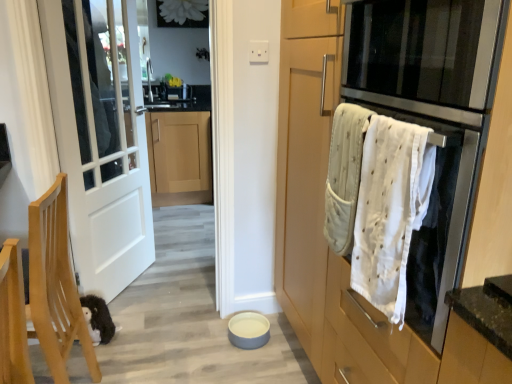
Where is `matte wood cabinet at right, positioned as the first cabinetry in front-to-back order`? This screenshot has width=512, height=384. matte wood cabinet at right, positioned as the first cabinetry in front-to-back order is located at coordinates (400, 125).

Measure the distance between white matte door at left and camera.

A distance of 1.73 meters exists between white matte door at left and camera.

At what (x,y) coordinates should I click in order to perform the action: click on wooden chair at lower left. Please return your answer as a coordinate pair (x, y). The image size is (512, 384). Looking at the image, I should click on (55, 285).

Is matte wood cabinet at right, which is the 1th cabinetry from right to left, positioned with its back to white textured towel at right?

Yes, matte wood cabinet at right, which is the 1th cabinetry from right to left,'s orientation is away from white textured towel at right.

Locate an element on the screen. bath towel that appears above the matte wood cabinet at right, which is the 1th cabinetry from right to left (from a real-world perspective) is located at coordinates (344, 175).

Which of these two, matte wood cabinet at right, which is the 1th cabinetry from right to left, or white textured towel at right, is smaller?

white textured towel at right is smaller.

Does point (480, 49) lie behind point (357, 157)?

No, it is not.

Is stainless steel oven at right, which is the first oven from top to bottom, with light wood cabinet at center, which is the first cabinetry in back-to-front order?

stainless steel oven at right, which is the first oven from top to bottom, is not next to light wood cabinet at center, which is the first cabinetry in back-to-front order, and they're not touching.

Does point (384, 22) come closer to viewer compared to point (170, 152)?

Yes, point (384, 22) is closer to viewer.

The height and width of the screenshot is (384, 512). In order to click on cabinetry above the stainless steel oven at right, which is the 2th oven in bottom-to-top order (from the image's perspective) in this screenshot , I will do `click(179, 157)`.

Between stainless steel oven at right, which is the 2th oven in bottom-to-top order, and light wood cabinet at center, arranged as the second cabinetry when viewed from the right, which one appears on the left side from the viewer's perspective?

light wood cabinet at center, arranged as the second cabinetry when viewed from the right.

From a real-world perspective, is white glossy sink at upper center physically located above or below white textured towel at right?

From a real-world perspective, white glossy sink at upper center is physically above white textured towel at right.

You are a GUI agent. You are given a task and a screenshot of the screen. Output one action in this format:
    pyautogui.click(x=<x>, y=<y>)
    Task: Click on the bath towel lying on the right of white glossy sink at upper center
    This screenshot has height=384, width=512.
    Given the screenshot: What is the action you would take?
    pyautogui.click(x=344, y=175)

Is white glossy sink at upper center surrounding white textured towel at right?

That's incorrect, white textured towel at right is not inside white glossy sink at upper center.

In the scene shown: Is white glossy sink at upper center touching white textured towel at right?

No, white glossy sink at upper center is not with white textured towel at right.

Based on the photo, is white matte door at left placed right next to white glossy sink at upper center?

No, white matte door at left is not in contact with white glossy sink at upper center.

Can you confirm if white matte door at left is smaller than white glossy sink at upper center?

Incorrect, white matte door at left is not smaller in size than white glossy sink at upper center.

From the image's perspective, would you say white matte door at left is positioned over white glossy sink at upper center?

No, from the image's perspective, white matte door at left is not over white glossy sink at upper center.

From a real-world perspective, is stainless steel oven at right, which is the first oven from top to bottom, positioned above or below stainless steel oven at right, which is the first oven from bottom to top?

From a real-world perspective, stainless steel oven at right, which is the first oven from top to bottom, is physically above stainless steel oven at right, which is the first oven from bottom to top.

Does stainless steel oven at right, which is the first oven from top to bottom, have a greater height compared to stainless steel oven at right, marked as the second oven in a top-to-bottom arrangement?

Incorrect, the height of stainless steel oven at right, which is the first oven from top to bottom, is not larger of that of stainless steel oven at right, marked as the second oven in a top-to-bottom arrangement.

Which object is closer to the camera, stainless steel oven at right, which is the 2th oven in bottom-to-top order, or stainless steel oven at right, marked as the second oven in a top-to-bottom arrangement?

stainless steel oven at right, which is the 2th oven in bottom-to-top order, is in front.

Is stainless steel oven at right, which is the first oven from top to bottom, placed right next to stainless steel oven at right, marked as the second oven in a top-to-bottom arrangement?

No.

Who is more distant, wooden chair at lower left or matte gray bowl at center?

Positioned behind is matte gray bowl at center.

Between wooden chair at lower left and matte gray bowl at center, which one has smaller width?

With smaller width is matte gray bowl at center.

From a real-world perspective, is wooden chair at lower left physically located above or below matte gray bowl at center?

Clearly, from a real-world perspective, wooden chair at lower left is above matte gray bowl at center.

Considering the positions of objects wooden chair at lower left and matte gray bowl at center in the image provided, who is more to the right, wooden chair at lower left or matte gray bowl at center?

Positioned to the right is matte gray bowl at center.

From a real-world perspective, relative to stainless steel oven at right, which is the first oven from bottom to top, is white glossy sink at upper center vertically above or below?

From a real-world perspective, white glossy sink at upper center is physically above stainless steel oven at right, which is the first oven from bottom to top.

Considering the sizes of objects white glossy sink at upper center and stainless steel oven at right, marked as the second oven in a top-to-bottom arrangement, in the image provided, who is taller, white glossy sink at upper center or stainless steel oven at right, marked as the second oven in a top-to-bottom arrangement,?

stainless steel oven at right, marked as the second oven in a top-to-bottom arrangement.

Does white glossy sink at upper center touch stainless steel oven at right, which is the first oven from bottom to top?

No, white glossy sink at upper center is not touching stainless steel oven at right, which is the first oven from bottom to top.

Is white glossy sink at upper center located outside stainless steel oven at right, which is the first oven from bottom to top?

Yes, white glossy sink at upper center is not within stainless steel oven at right, which is the first oven from bottom to top.

This screenshot has width=512, height=384. I want to click on bath towel on the left of matte wood cabinet at right, positioned as the first cabinetry in front-to-back order, so click(x=344, y=175).

Find the location of a particular element. The height and width of the screenshot is (384, 512). the 2nd oven positioned above the light wood cabinet at center, arranged as the second cabinetry when viewed from the right (from a real-world perspective) is located at coordinates (423, 49).

When comparing their distances from light wood cabinet at center, arranged as the first cabinetry when viewed from the left, does white glossy sink at upper center or white matte door at left seem closer?

white glossy sink at upper center is positioned closer to the anchor light wood cabinet at center, arranged as the first cabinetry when viewed from the left.

Based on their spatial positions, is white glossy sink at upper center or matte wood cabinet at right, which appears as the 2th cabinetry when viewed from the back, further from stainless steel oven at right, which is the first oven from bottom to top?

The object further to stainless steel oven at right, which is the first oven from bottom to top, is white glossy sink at upper center.

Considering their positions, is light wood cabinet at center, arranged as the second cabinetry when viewed from the right, positioned closer to white textured towel at right than matte wood cabinet at right, which appears as the 2th cabinetry when viewed from the back?

Based on the image, matte wood cabinet at right, which appears as the 2th cabinetry when viewed from the back, appears to be nearer to white textured towel at right.

Looking at the image, which one is located further to white glossy sink at upper center, white textured towel at right or stainless steel oven at right, which is the first oven from top to bottom?

stainless steel oven at right, which is the first oven from top to bottom.

Based on their spatial positions, is wooden chair at lower left or stainless steel oven at right, which is the first oven from bottom to top, closer to matte wood cabinet at right, which appears as the 2th cabinetry when viewed from the back?

stainless steel oven at right, which is the first oven from bottom to top, is closer to matte wood cabinet at right, which appears as the 2th cabinetry when viewed from the back.

Based on their spatial positions, is white textured towel at right or stainless steel oven at right, which is the first oven from bottom to top, closer to matte wood cabinet at right, positioned as the first cabinetry in front-to-back order?

stainless steel oven at right, which is the first oven from bottom to top, is closer to matte wood cabinet at right, positioned as the first cabinetry in front-to-back order.

From the image, which object appears to be farther from matte gray bowl at center, stainless steel oven at right, which is the 2th oven in bottom-to-top order, or stainless steel oven at right, marked as the second oven in a top-to-bottom arrangement?

stainless steel oven at right, which is the 2th oven in bottom-to-top order, is further to matte gray bowl at center.

Considering their positions, is white textured towel at right positioned closer to white matte door at left than white glossy sink at upper center?

white textured towel at right lies closer to white matte door at left than the other object.

Find the location of a particular element. This screenshot has width=512, height=384. door positioned between wooden chair at lower left and light wood cabinet at center, arranged as the second cabinetry when viewed from the right, from near to far is located at coordinates (100, 138).

The image size is (512, 384). Identify the location of oven between wooden chair at lower left and matte wood cabinet at right, which appears as the 2th cabinetry when viewed from the back, in the horizontal direction. tap(404, 211).

The width and height of the screenshot is (512, 384). Identify the location of cabinetry between matte wood cabinet at right, which appears as the 2th cabinetry when viewed from the back, and white glossy sink at upper center in the front-back direction. (179, 157).

Where is `door between matte wood cabinet at right, which is the 1th cabinetry from right to left, and matte gray bowl at center, along the z-axis`? The width and height of the screenshot is (512, 384). door between matte wood cabinet at right, which is the 1th cabinetry from right to left, and matte gray bowl at center, along the z-axis is located at coordinates (100, 138).